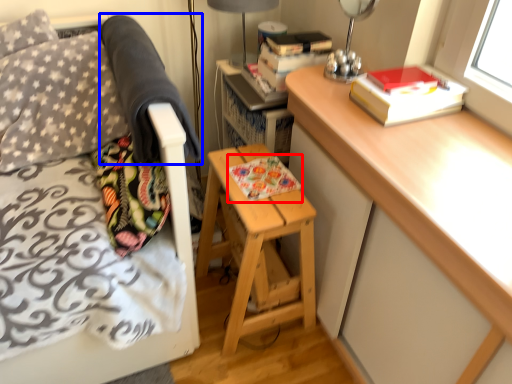
Question: Which object is closer to the camera taking this photo, book (highlighted by a red box) or blanket (highlighted by a blue box)?

Choices:
 (A) book
 (B) blanket

Answer: (B)